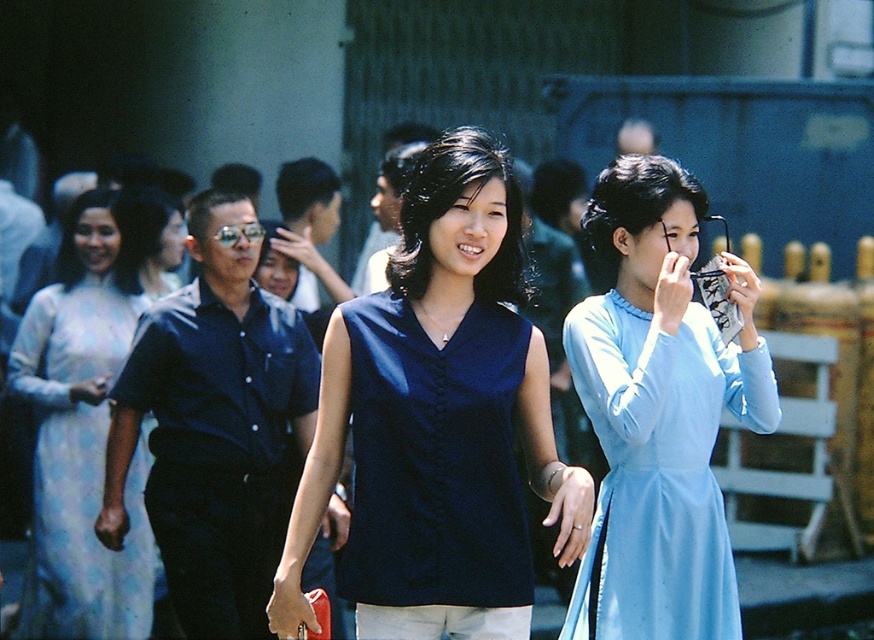
You are a fashion designer observing a street scene with two central items of clothing, the light blue silk dress at center and the shiny blue shirt at center. Which one has a shorter length?

The light blue silk dress at center is shorter than the shiny blue shirt at center, so the light blue silk dress at center has a shorter length.

You are a photographer who wants to capture both the light blue silk dress at center and the white silk ao dai at left in the same frame. Based on their positions, which one should you adjust your camera angle to focus on first to ensure both are in the shot?

Since the light blue silk dress at center is to the right of the white silk ao dai at left, you should focus on the white silk ao dai at left first to ensure both are included in the frame.